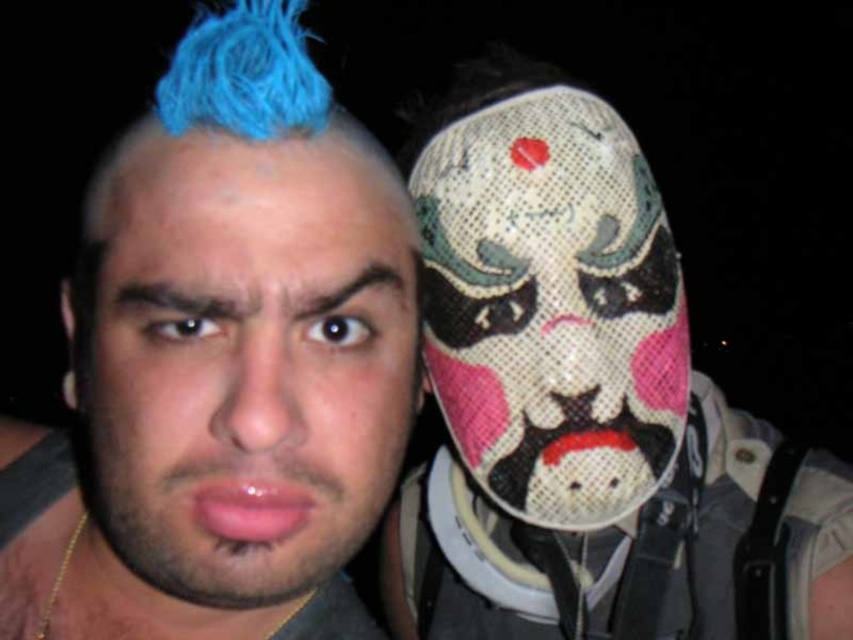
You are a photographer trying to capture a portrait of the two people in the image. You want to ensure that the mesh fabric mask at right and the matte blue hair at left are both clearly visible in the frame. Based on their positions, which object is closer to the center of the image?

The matte blue hair at left is closer to the center of the image because the mesh fabric mask at right is positioned on the right side of it.

You are a photographer adjusting your camera settings to focus on both the mesh fabric mask at right and the matte blue hair at left. Which object should you focus on first to ensure both are in sharp focus?

You should focus on the matte blue hair at left first because it is closer to the camera than the mesh fabric mask at right, ensuring both are in focus when using depth of field techniques.

Looking at this image, you are a photographer standing 20 inches away from the two people in the image. You want to take a closeup shot of the mesh fabric mask at right without moving your camera. Can you do it?

The mesh fabric mask at right is 18.57 inches away from the viewer, which is within the 20 inches distance you are standing. Therefore, you can take a closeup shot of the mesh fabric mask at right without moving your camera.